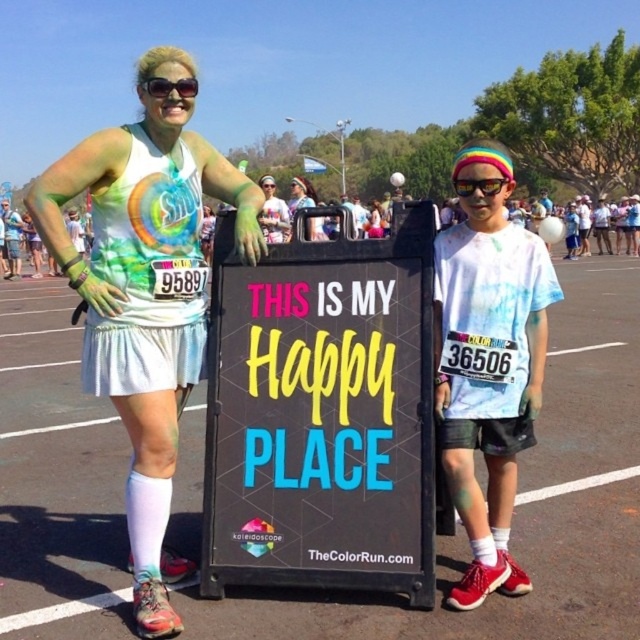
Question: Can you confirm if matte tie-dye tank top at center is positioned below sunglasses at upper center?

Choices:
 (A) yes
 (B) no

Answer: (A)

Question: Is matte tie-dye tank top at center positioned at the back of multicolored plastic goggles at center?

Choices:
 (A) yes
 (B) no

Answer: (B)

Question: Does matte tie-dye tank top at center have a greater width compared to multicolored plastic goggles at center?

Choices:
 (A) no
 (B) yes

Answer: (B)

Question: Which point is farther from the camera taking this photo?

Choices:
 (A) [502, 371]
 (B) [305, 205]

Answer: (B)

Question: Which object appears farthest from the camera in this image?

Choices:
 (A) matte white t-shirt at center
 (B) sunglasses at upper center
 (C) matte white tank top at center

Answer: (C)

Question: Which of the following is the closest to the observer?

Choices:
 (A) matte tie-dye tank top at center
 (B) sunglasses at upper center
 (C) multicolored plastic goggles at center
 (D) matte white tank top at center

Answer: (A)